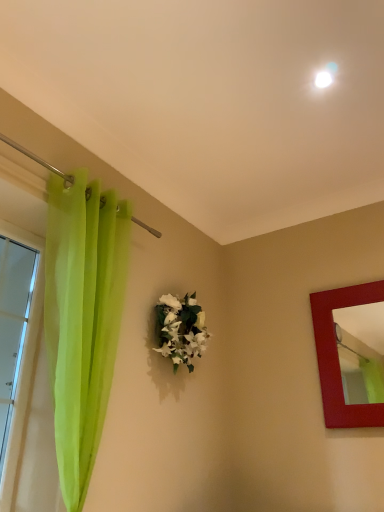
Question: Does white matte floral arrangement at center have a smaller size compared to matte red picture frame at right?

Choices:
 (A) no
 (B) yes

Answer: (B)

Question: Is white matte floral arrangement at center located outside matte red picture frame at right?

Choices:
 (A) yes
 (B) no

Answer: (A)

Question: Is white matte floral arrangement at center thinner than matte red picture frame at right?

Choices:
 (A) yes
 (B) no

Answer: (B)

Question: Can you confirm if white matte floral arrangement at center is taller than matte red picture frame at right?

Choices:
 (A) yes
 (B) no

Answer: (B)

Question: From the image's perspective, would you say white matte floral arrangement at center is shown under matte red picture frame at right?

Choices:
 (A) yes
 (B) no

Answer: (B)

Question: From the image's perspective, is transparent green curtain at left above or below matte red picture frame at right?

Choices:
 (A) below
 (B) above

Answer: (B)

Question: Is transparent green curtain at left wider or thinner than matte red picture frame at right?

Choices:
 (A) thin
 (B) wide

Answer: (A)

Question: Is point (18, 307) closer or farther from the camera than point (347, 291)?

Choices:
 (A) farther
 (B) closer

Answer: (A)

Question: Is transparent green curtain at left taller or shorter than matte red picture frame at right?

Choices:
 (A) tall
 (B) short

Answer: (A)

Question: From the image's perspective, is transparent green curtain at left located above or below white matte floral arrangement at center?

Choices:
 (A) above
 (B) below

Answer: (B)

Question: Considering the positions of transparent green curtain at left and white matte floral arrangement at center in the image, is transparent green curtain at left wider or thinner than white matte floral arrangement at center?

Choices:
 (A) wide
 (B) thin

Answer: (B)

Question: Looking at the image, does transparent green curtain at left seem bigger or smaller compared to white matte floral arrangement at center?

Choices:
 (A) small
 (B) big

Answer: (B)

Question: From a real-world perspective, is transparent green curtain at left positioned above or below white matte floral arrangement at center?

Choices:
 (A) above
 (B) below

Answer: (B)

Question: In the image, is matte red picture frame at right on the left side or the right side of transparent green curtain at left?

Choices:
 (A) right
 (B) left

Answer: (A)

Question: In terms of size, does matte red picture frame at right appear bigger or smaller than transparent green curtain at left?

Choices:
 (A) small
 (B) big

Answer: (B)